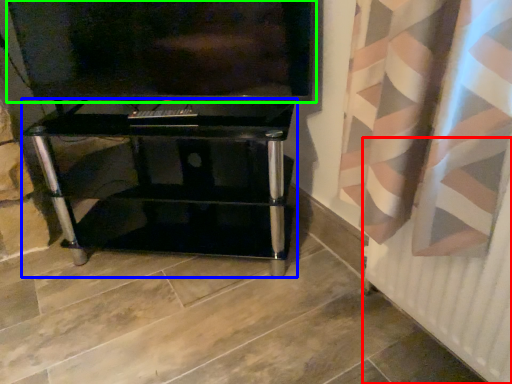
Question: Which is farther away from radiator (highlighted by a red box)? furniture (highlighted by a blue box) or television (highlighted by a green box)?

Choices:
 (A) furniture
 (B) television

Answer: (B)